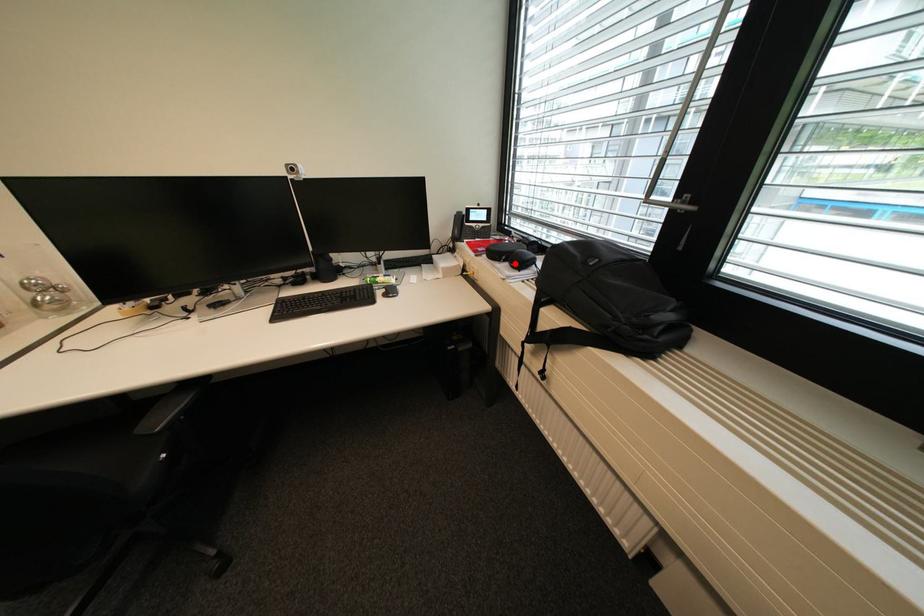
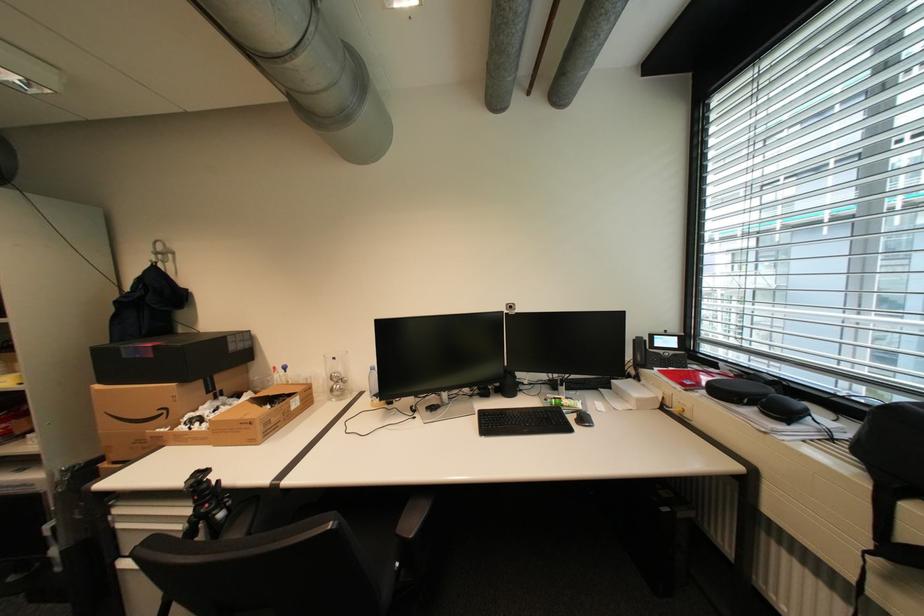
Where in the second image is the point corresponding to the highlighted location from the first image?

(763, 410)